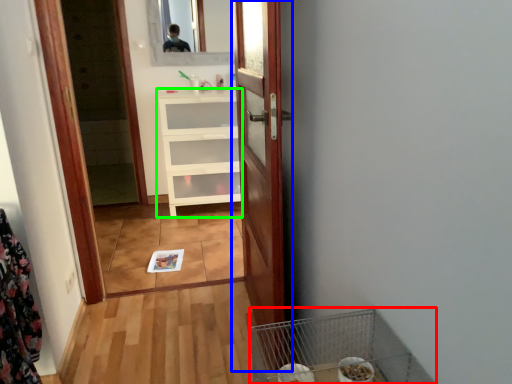
Question: Considering the real-world distances, which object is farthest from bird cage (highlighted by a red box)? door (highlighted by a blue box) or cabinetry (highlighted by a green box)?

Choices:
 (A) door
 (B) cabinetry

Answer: (B)